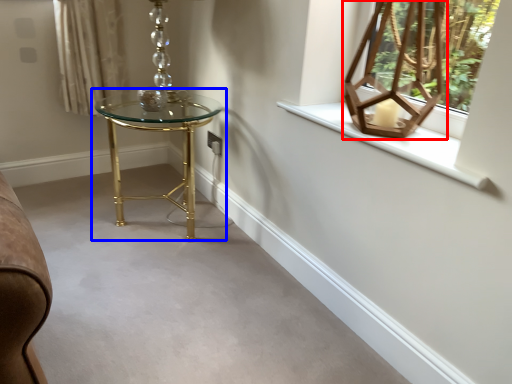
Question: Which object appears farthest to the camera in this image, table lamp (highlighted by a red box) or table (highlighted by a blue box)?

Choices:
 (A) table lamp
 (B) table

Answer: (B)